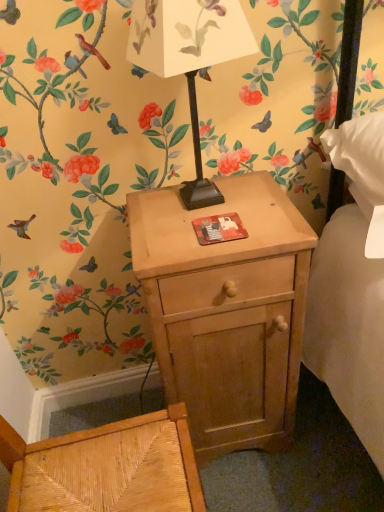
Find the location of a particular element. Image resolution: width=384 pixels, height=512 pixels. free location to the right of matte black table lamp at center is located at coordinates (267, 204).